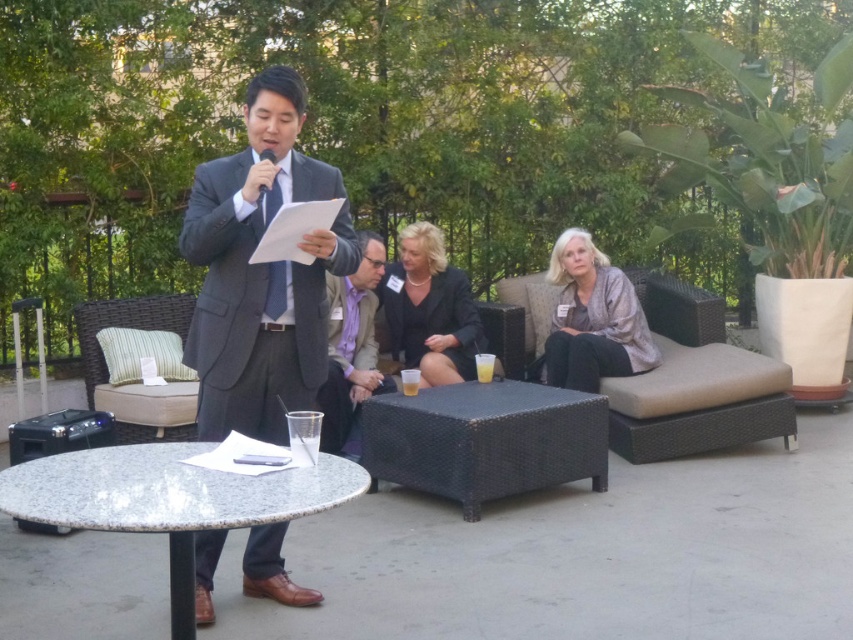
Can you confirm if dark gray suit at center is positioned above granite table at center?

Indeed, dark gray suit at center is positioned over granite table at center.

Which is in front, point (212, 310) or point (155, 484)?

Point (155, 484) is more forward.

Which is behind, point (204, 294) or point (184, 577)?

Positioned behind is point (204, 294).

Where is `dark gray suit at center`? dark gray suit at center is located at coordinates (260, 272).

Measure the distance between gray textured blouse at center and black fabric jacket at center.

They are 30.59 inches apart.

Is point (627, 316) closer to camera compared to point (438, 292)?

Yes, it is.

Find the location of a particular element. The width and height of the screenshot is (853, 640). gray textured blouse at center is located at coordinates (593, 317).

Does dark gray suit at center lie behind black fabric jacket at center?

No.

Does point (305, 305) come in front of point (407, 356)?

That is True.

This screenshot has width=853, height=640. I want to click on dark gray suit at center, so click(x=260, y=272).